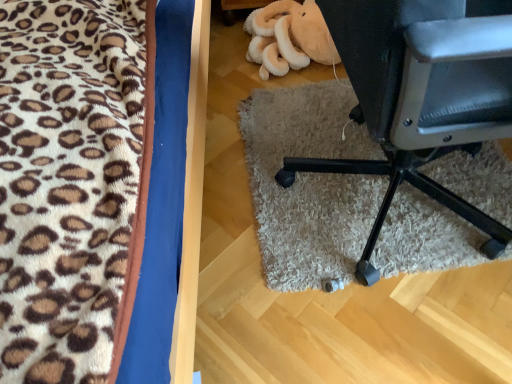
Question: Can you confirm if black leather chair at lower right is positioned to the right of soft plush toy at upper center?

Choices:
 (A) yes
 (B) no

Answer: (A)

Question: Is black leather chair at lower right closer to the viewer compared to soft plush toy at upper center?

Choices:
 (A) yes
 (B) no

Answer: (A)

Question: Are black leather chair at lower right and soft plush toy at upper center located far from each other?

Choices:
 (A) no
 (B) yes

Answer: (A)

Question: Could soft plush toy at upper center be considered to be inside black leather chair at lower right?

Choices:
 (A) yes
 (B) no

Answer: (B)

Question: Is black leather chair at lower right bigger than soft plush toy at upper center?

Choices:
 (A) yes
 (B) no

Answer: (A)

Question: Is soft plush toy at upper center spatially inside black leather chair at lower right, or outside of it?

Choices:
 (A) outside
 (B) inside

Answer: (A)

Question: Considering the positions of soft plush toy at upper center and black leather chair at lower right in the image, is soft plush toy at upper center wider or thinner than black leather chair at lower right?

Choices:
 (A) wide
 (B) thin

Answer: (B)

Question: Based on their sizes in the image, would you say soft plush toy at upper center is bigger or smaller than black leather chair at lower right?

Choices:
 (A) big
 (B) small

Answer: (B)

Question: In terms of height, does soft plush toy at upper center look taller or shorter compared to black leather chair at lower right?

Choices:
 (A) short
 (B) tall

Answer: (A)

Question: Do you think fluffy leopard print blanket at left is within soft plush toy at upper center, or outside of it?

Choices:
 (A) inside
 (B) outside

Answer: (B)

Question: Is point (48, 329) closer or farther from the camera than point (287, 8)?

Choices:
 (A) farther
 (B) closer

Answer: (B)

Question: From a real-world perspective, relative to soft plush toy at upper center, is fluffy leopard print blanket at left vertically above or below?

Choices:
 (A) above
 (B) below

Answer: (A)

Question: From the image's perspective, is fluffy leopard print blanket at left above or below soft plush toy at upper center?

Choices:
 (A) above
 (B) below

Answer: (B)

Question: From the image's perspective, is soft plush toy at upper center located above or below fluffy leopard print blanket at left?

Choices:
 (A) below
 (B) above

Answer: (B)

Question: Is soft plush toy at upper center bigger or smaller than fluffy leopard print blanket at left?

Choices:
 (A) small
 (B) big

Answer: (A)